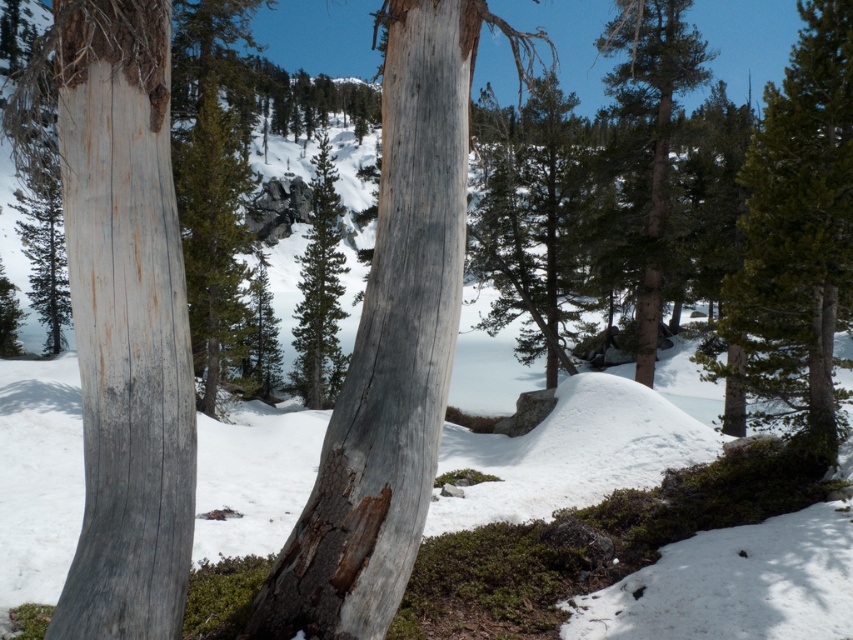
Question: Which point is closer to the camera?

Choices:
 (A) green textured pine tree at center
 (B) gray rough bark tree trunk at center
 (C) green textured tree at right

Answer: (B)

Question: Is gray rough bark tree trunk at center thinner than green textured pine tree at center?

Choices:
 (A) yes
 (B) no

Answer: (A)

Question: Which point appears closest to the camera in this image?

Choices:
 (A) (770, 394)
 (B) (337, 356)
 (C) (428, 148)

Answer: (C)

Question: Is gray wood tree trunk at center bigger than gray rough bark tree trunk at center?

Choices:
 (A) yes
 (B) no

Answer: (B)

Question: Can you confirm if green textured tree at right is thinner than green textured tree at center?

Choices:
 (A) no
 (B) yes

Answer: (A)

Question: Considering the real-world distances, which object is farthest from the green textured tree at right?

Choices:
 (A) gray rough bark tree trunk at center
 (B) gray wood tree trunk at center

Answer: (A)